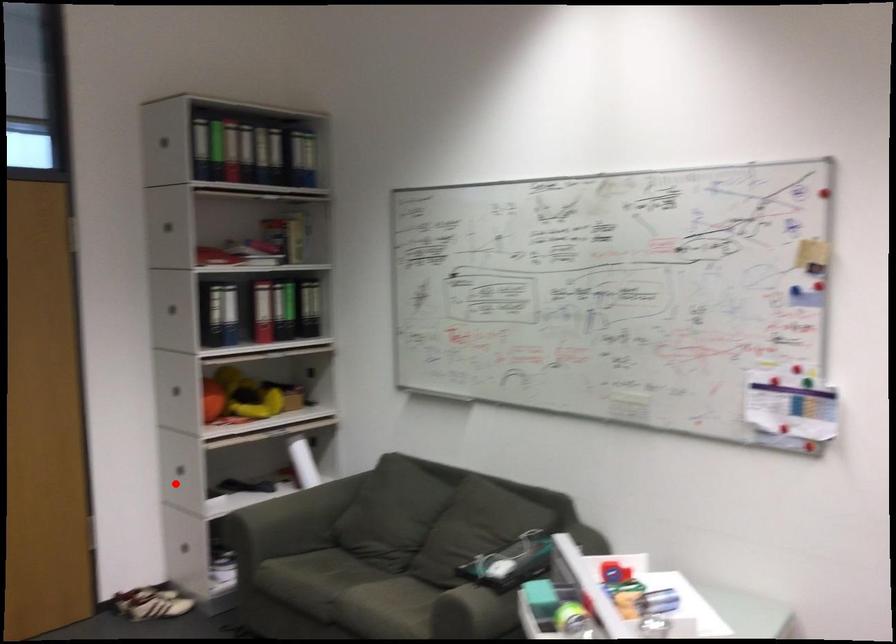
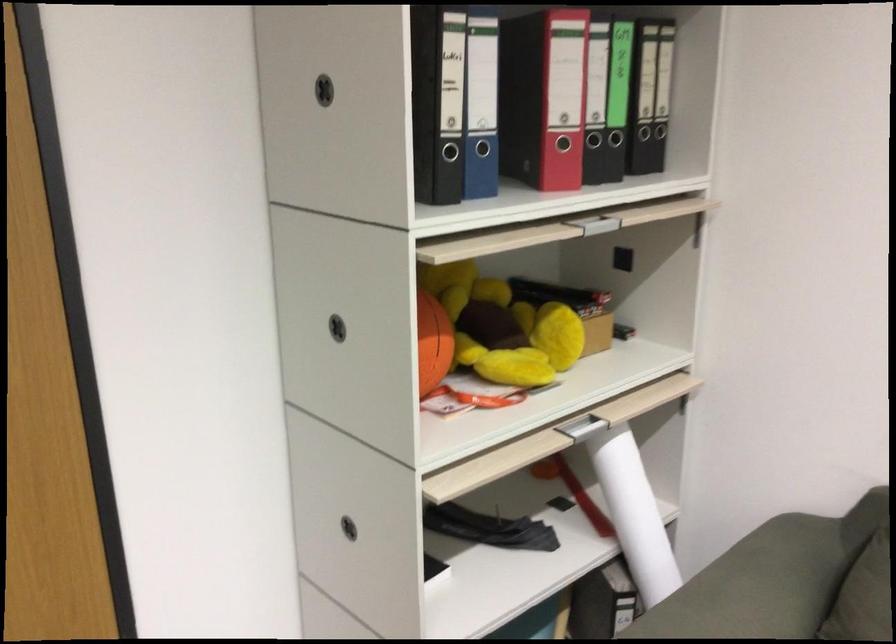
Where in the second image is the point corresponding to the highlighted location from the first image?

(348, 527)